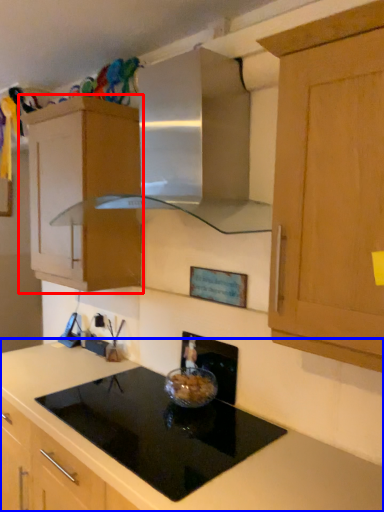
Question: Among these objects, which one is farthest to the camera, cabinetry (highlighted by a red box) or countertop (highlighted by a blue box)?

Choices:
 (A) cabinetry
 (B) countertop

Answer: (A)